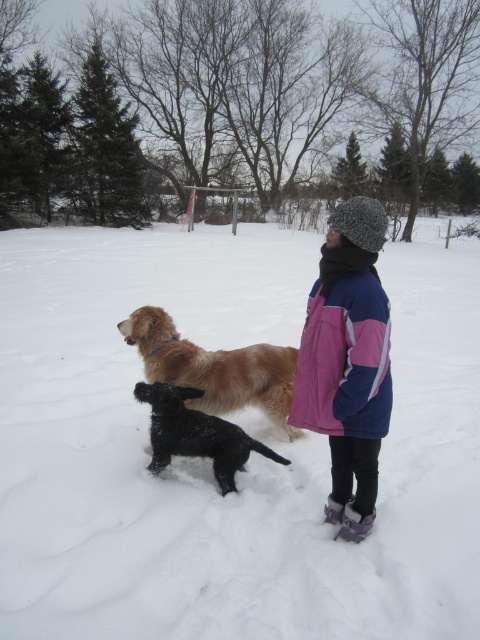
Question: Can you confirm if golden fur dog at center is positioned to the right of shiny black dog at center?

Choices:
 (A) no
 (B) yes

Answer: (B)

Question: Can you confirm if white fluffy snow at center is positioned to the right of pink fleece jacket at center?

Choices:
 (A) yes
 (B) no

Answer: (B)

Question: Based on their relative distances, which object is nearer to the shiny black dog at center?

Choices:
 (A) white fluffy snow at center
 (B) golden fur dog at center
 (C) pink fleece jacket at center

Answer: (B)

Question: Considering the relative positions of white fluffy snow at center and pink fleece jacket at center in the image provided, where is white fluffy snow at center located with respect to pink fleece jacket at center?

Choices:
 (A) below
 (B) above

Answer: (B)

Question: Among these points, which one is farthest from the camera?

Choices:
 (A) (203, 364)
 (B) (157, 433)

Answer: (A)

Question: Which point is closer to the camera?

Choices:
 (A) (245, 234)
 (B) (197, 410)

Answer: (B)